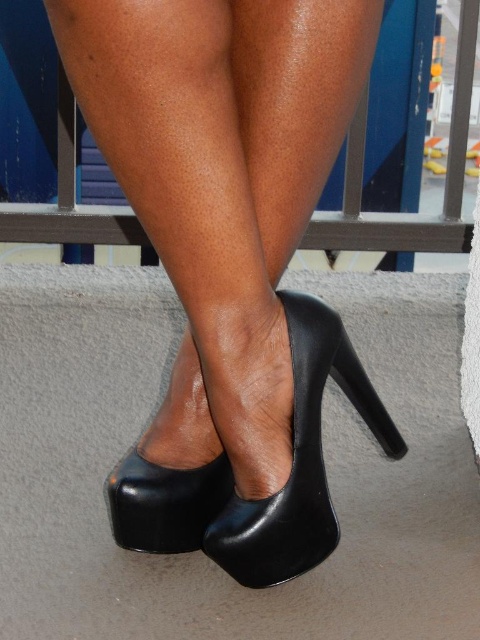
Is point (269, 451) farther from camera compared to point (155, 522)?

That is False.

Which is below, black leather high heels at center or black leather high-heeled shoe at lower center?

Positioned lower is black leather high-heeled shoe at lower center.

Between point (314, 330) and point (191, 474), which one is positioned in front?

Positioned in front is point (314, 330).

Find the location of a particular element. This screenshot has width=480, height=640. black leather high heels at center is located at coordinates (229, 259).

Does black leather high-heeled shoe at center have a greater height compared to black leather high-heeled shoe at lower center?

Yes.

Can you confirm if black leather high-heeled shoe at center is wider than black leather high-heeled shoe at lower center?

Correct, the width of black leather high-heeled shoe at center exceeds that of black leather high-heeled shoe at lower center.

Does point (379, 420) come in front of point (146, 538)?

No, it is behind (146, 538).

The height and width of the screenshot is (640, 480). What are the coordinates of `black leather high-heeled shoe at center` in the screenshot? It's located at (298, 460).

Does black leather high heels at center appear on the left side of black leather high-heeled shoe at center?

Indeed, black leather high heels at center is positioned on the left side of black leather high-heeled shoe at center.

Between black leather high heels at center and black leather high-heeled shoe at center, which one is positioned lower?

black leather high-heeled shoe at center is below.

The height and width of the screenshot is (640, 480). I want to click on black leather high heels at center, so click(229, 259).